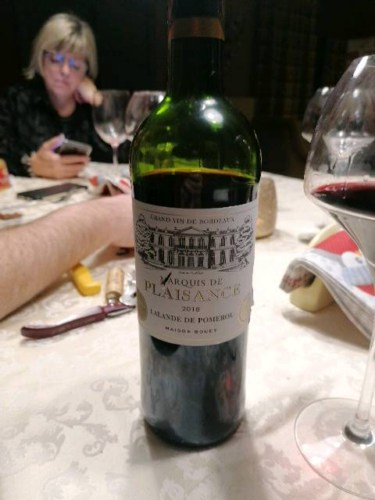
Find the location of `green bottle of wine`. green bottle of wine is located at coordinates [190, 158].